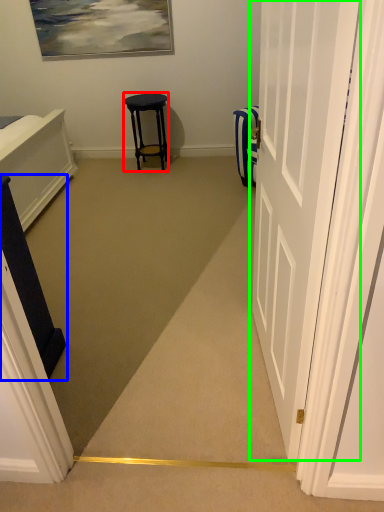
Question: Estimate the real-world distances between objects in this image. Which object is farther from stool (highlighted by a red box), furniture (highlighted by a blue box) or door (highlighted by a green box)?

Choices:
 (A) furniture
 (B) door

Answer: (B)